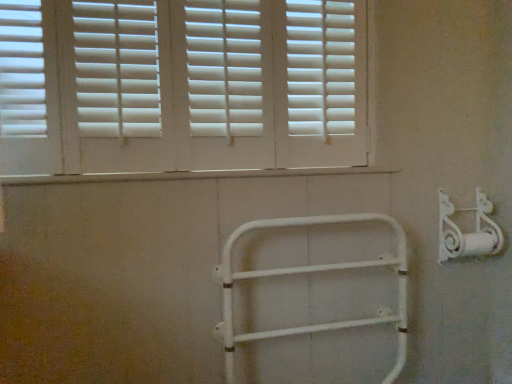
Question: Is white matte metal rail at center bigger or smaller than white matte shutters at upper center?

Choices:
 (A) big
 (B) small

Answer: (B)

Question: Is point (246, 228) positioned closer to the camera than point (6, 1)?

Choices:
 (A) closer
 (B) farther

Answer: (B)

Question: Which is farther from the white matte metal rail at center?

Choices:
 (A) white matte bracket at right
 (B) white matte shutters at upper center

Answer: (B)

Question: Which object is the farthest from the white matte metal rail at center?

Choices:
 (A) white matte bracket at right
 (B) white matte shutters at upper center

Answer: (B)